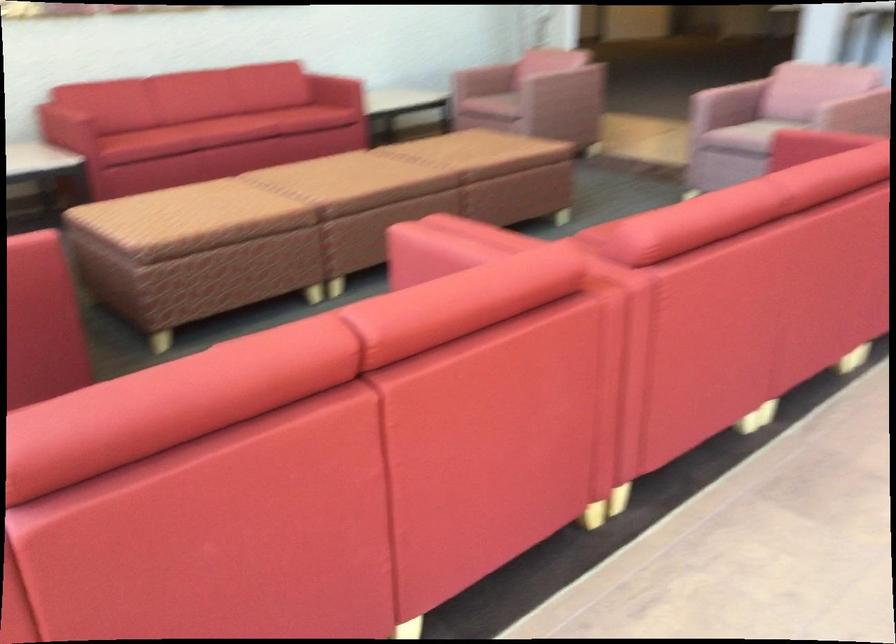
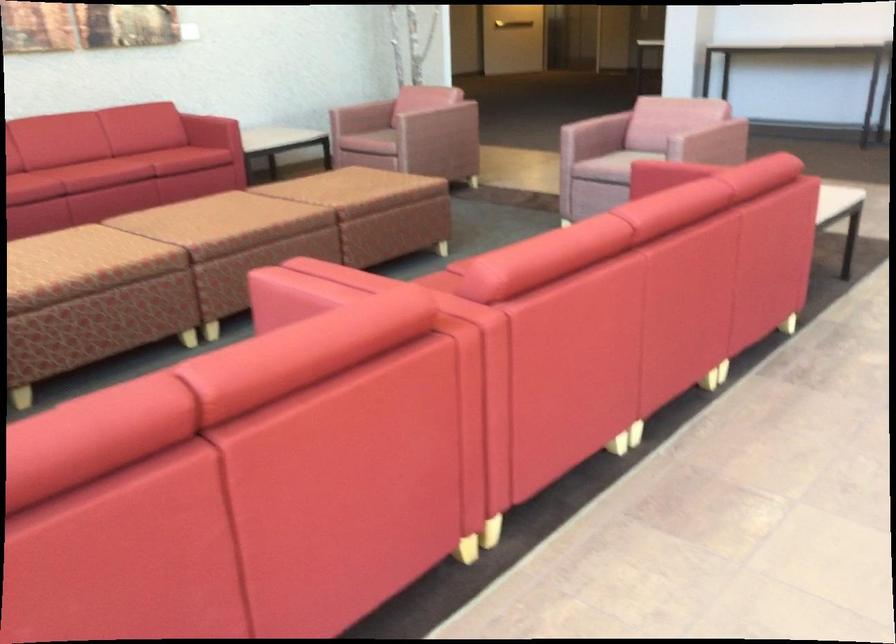
The point at (222, 214) is marked in the first image. Where is the corresponding point in the second image?

(83, 265)